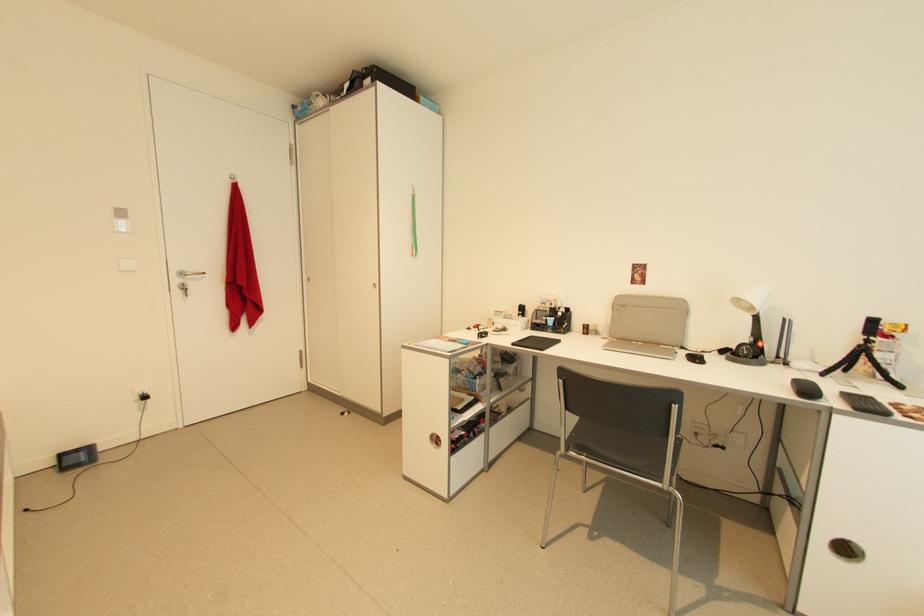
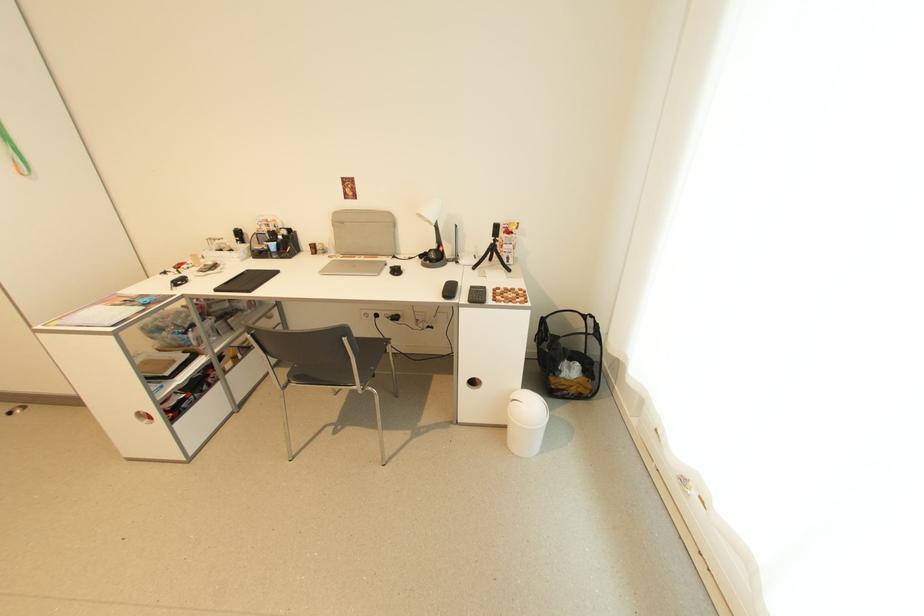
Find the pixel in the second image that matches [682,354] in the first image.

(391, 265)